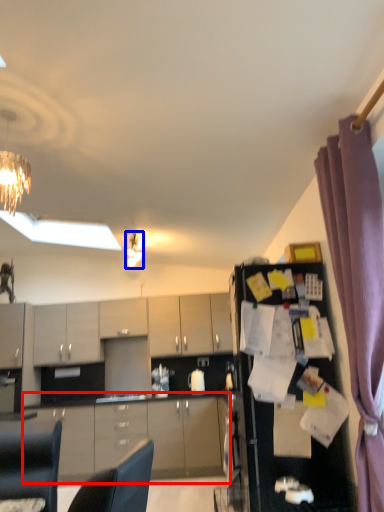
Question: Which object appears farthest to the camera in this image, cabinetry (highlighted by a red box) or light fixture (highlighted by a blue box)?

Choices:
 (A) cabinetry
 (B) light fixture

Answer: (A)